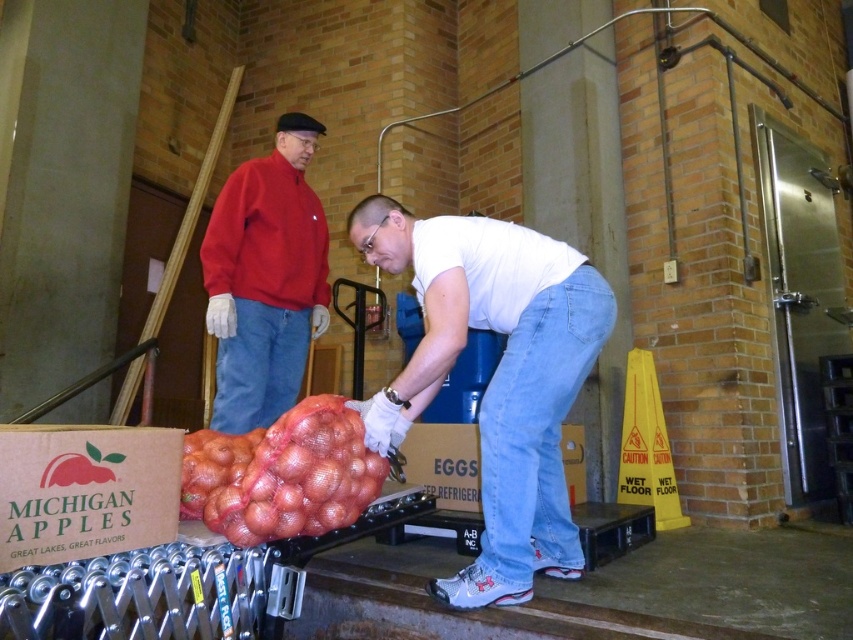
Which is below, white matte shirt at center or red mesh bag of apples at center?

Positioned lower is red mesh bag of apples at center.

Is point (370, 433) positioned after point (299, 528)?

That is True.

This screenshot has height=640, width=853. What are the coordinates of `white matte shirt at center` in the screenshot? It's located at (494, 376).

Who is higher up, red fleece jacket at upper left or blue denim jeans at center?

red fleece jacket at upper left

Which is behind, point (306, 122) or point (271, 352)?

The point (306, 122) is more distant.

Where is `red fleece jacket at upper left`? This screenshot has width=853, height=640. red fleece jacket at upper left is located at coordinates tap(265, 278).

Does light blue denim jeans at lower center appear over red mesh bag of apples at center?

Yes.

Between point (587, 356) and point (376, 477), which one is positioned behind?

Positioned behind is point (587, 356).

Who is more distant from viewer, (485, 528) or (238, 474)?

Positioned behind is point (485, 528).

Locate an element on the screen. The image size is (853, 640). light blue denim jeans at lower center is located at coordinates (537, 426).